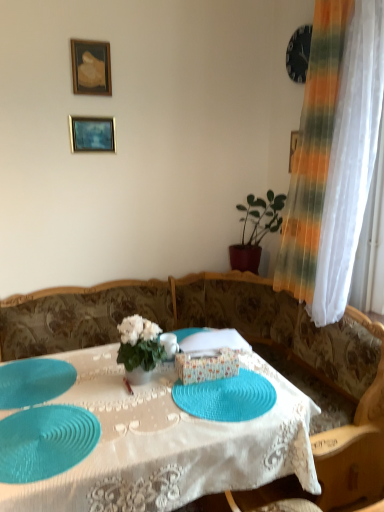
Locate an element on the screen. The height and width of the screenshot is (512, 384). vacant area that lies between white fabric flower at center and teal rubber placemat at lower left, the second glass plate in the right-to-left sequence is located at coordinates (112, 404).